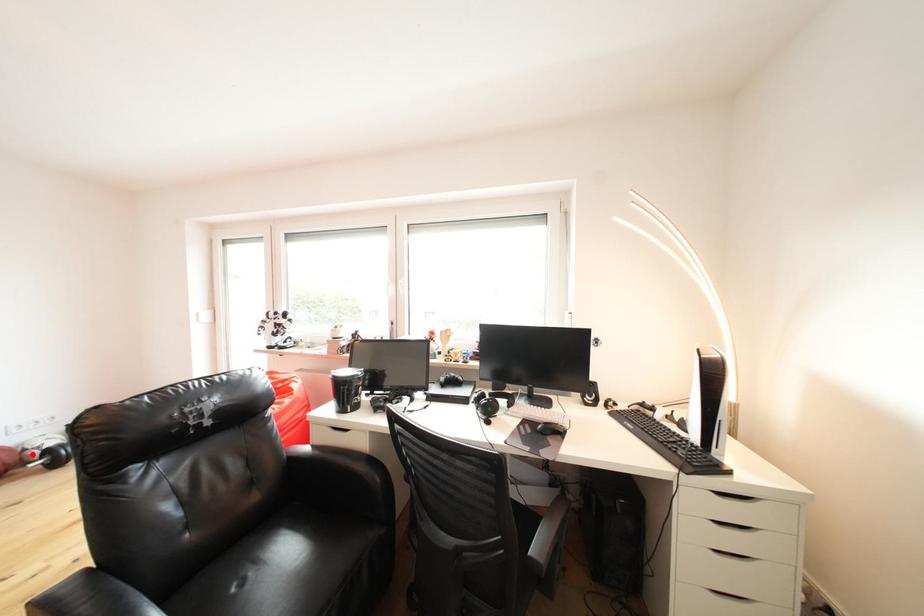
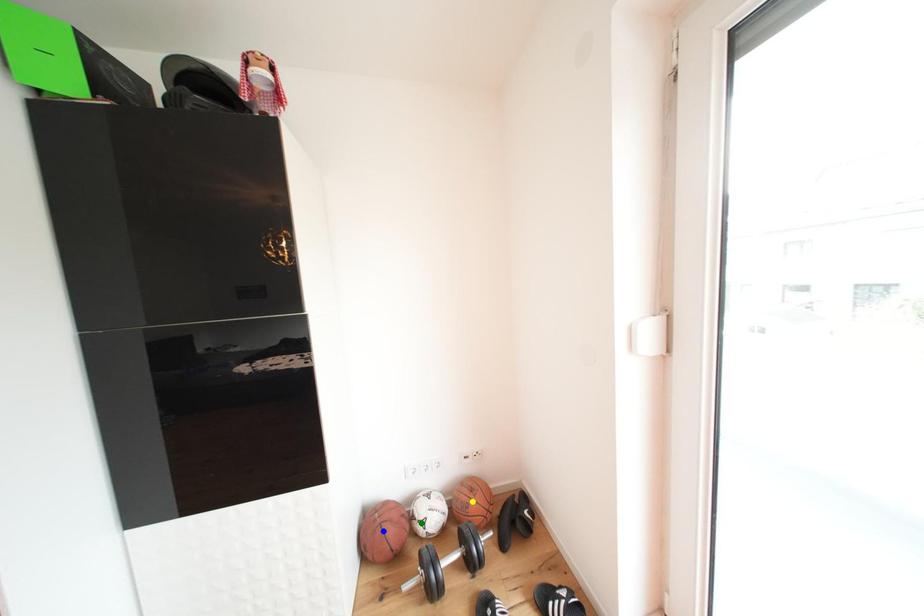
Question: I am providing you with two images of the same scene from different viewpoints. A red point is marked on the first image. You are given multiple points on the second image. Can you choose the point in image 2 that corresponds to the point in image 1?

Choices:
 (A) blue point
 (B) green point
 (C) yellow point

Answer: (B)